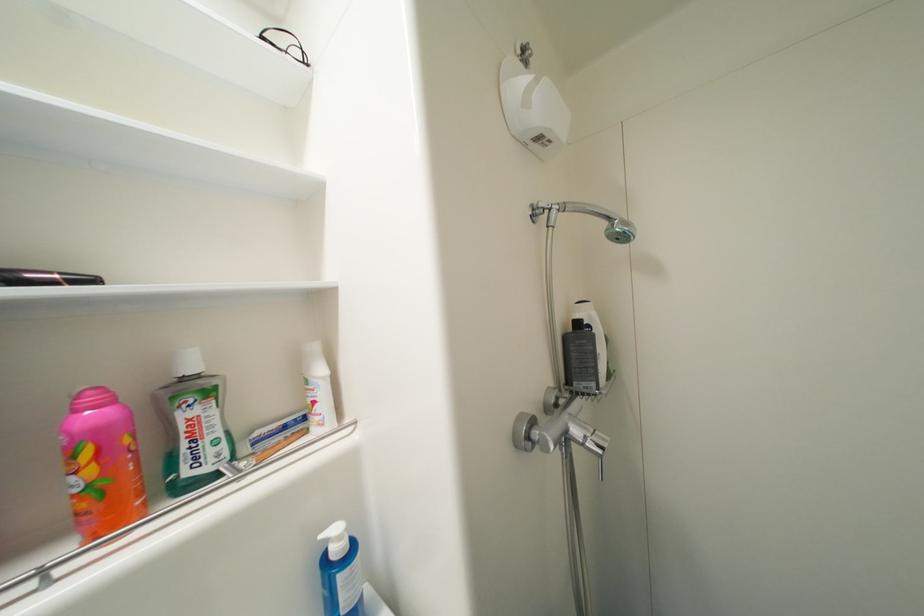
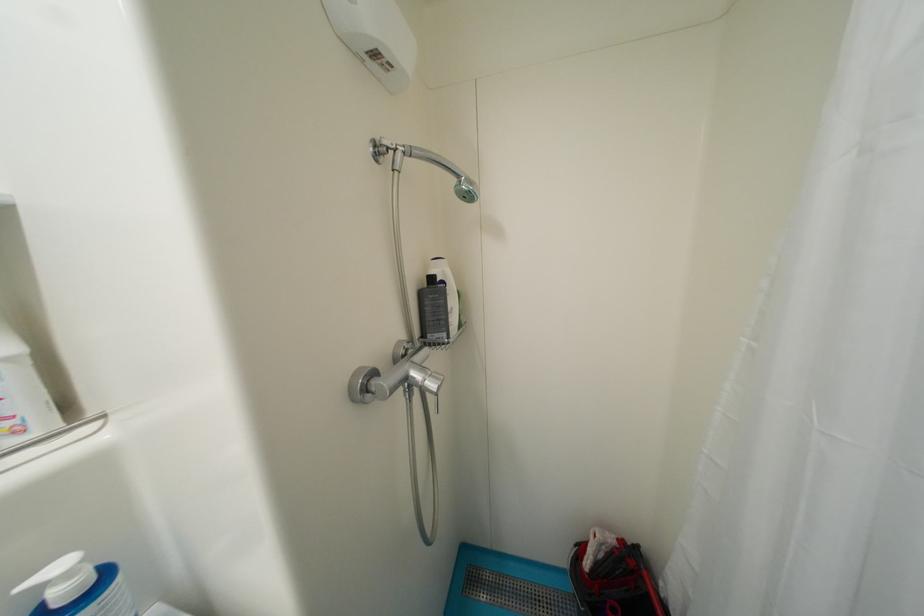
Find the pixel in the second image that matches the point at 629,240 in the first image.

(476, 199)